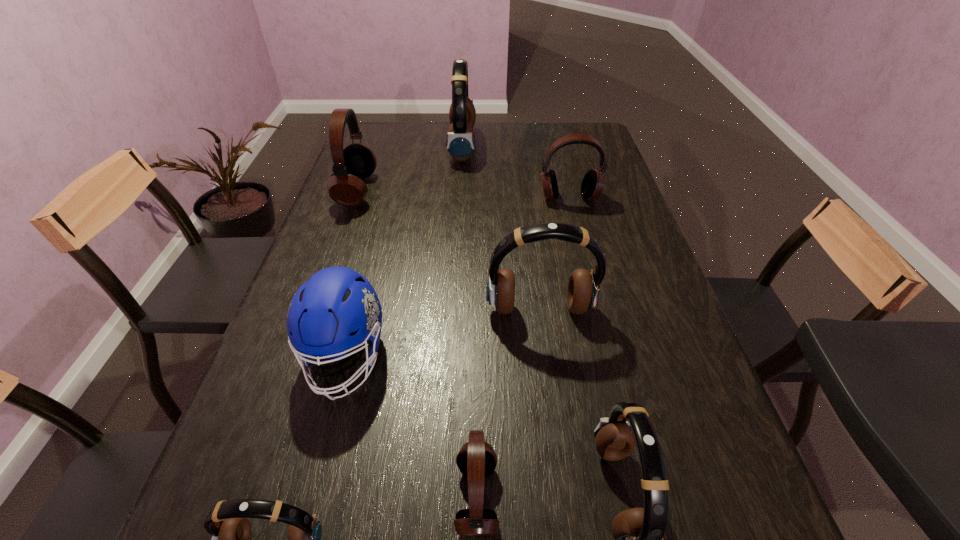
This screenshot has width=960, height=540. In order to click on the farthest object in this screenshot , I will do `click(460, 140)`.

At what (x,y) coordinates should I click in order to perform the action: click on the second brown headset from left to right. Please return your answer as a coordinate pair (x, y). Looking at the image, I should click on (460, 140).

Image resolution: width=960 pixels, height=540 pixels. What are the coordinates of `the leftmost black headset` in the screenshot? It's located at (355, 162).

What are the coordinates of `the third smallest brown headset` in the screenshot? It's located at (583, 291).

At what (x,y) coordinates should I click in order to perform the action: click on the second farthest brown headset. Please return your answer as a coordinate pair (x, y). This screenshot has width=960, height=540. Looking at the image, I should click on (583, 291).

Find the location of a particular element. This screenshot has height=540, width=960. football helmet is located at coordinates (336, 301).

Where is `the second biggest black headset`? This screenshot has height=540, width=960. the second biggest black headset is located at coordinates (592, 185).

Locate an element on the screen. The image size is (960, 540). free space located 0.120m on the ear cup of the farthest object is located at coordinates (509, 146).

The width and height of the screenshot is (960, 540). I want to click on vacant space located 0.390m on the ear pads of the biggest black headset, so click(x=498, y=190).

You are a GUI agent. You are given a task and a screenshot of the screen. Output one action in this format:
    pyautogui.click(x=<x>, y=<y>)
    Task: Click on the vacant space located on the ear cup of the third smallest brown headset
    Image resolution: width=960 pixels, height=540 pixels.
    Given the screenshot: What is the action you would take?
    pyautogui.click(x=562, y=469)